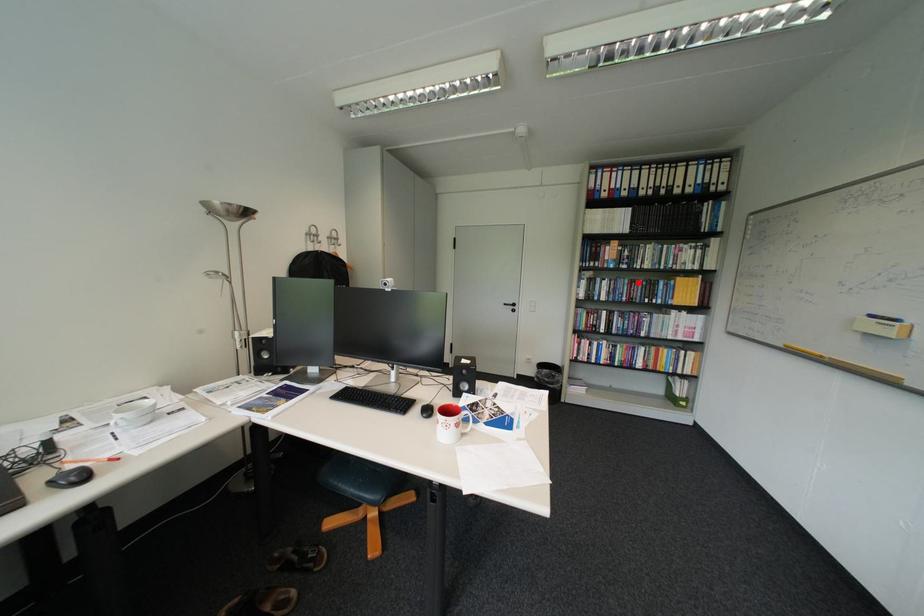
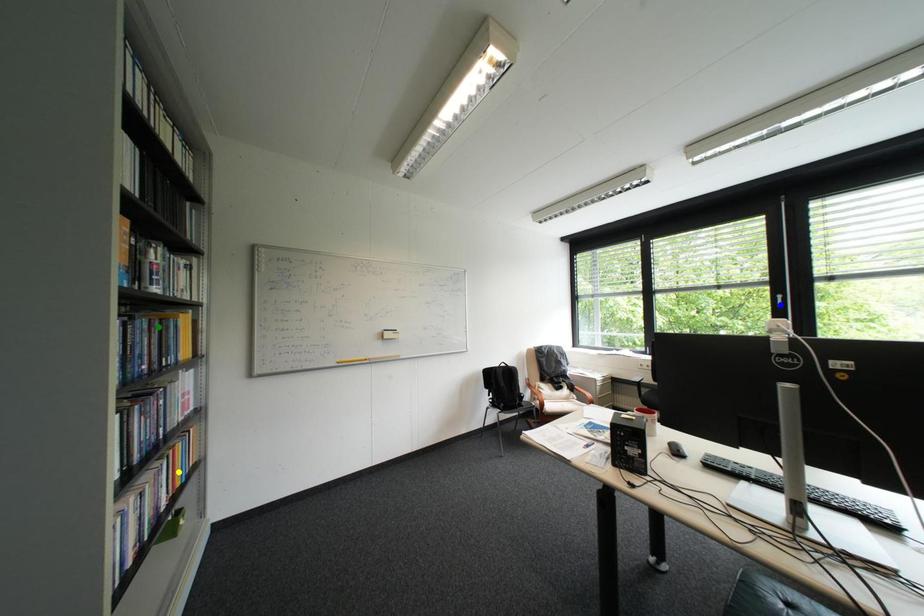
Question: I am providing you with two images of the same scene from different viewpoints. A red point is marked on the first image. You are given multiple points on the second image. Which mark in image 2 goes with the point in image 1?

Choices:
 (A) yellow point
 (B) green point
 (C) blue point

Answer: (B)